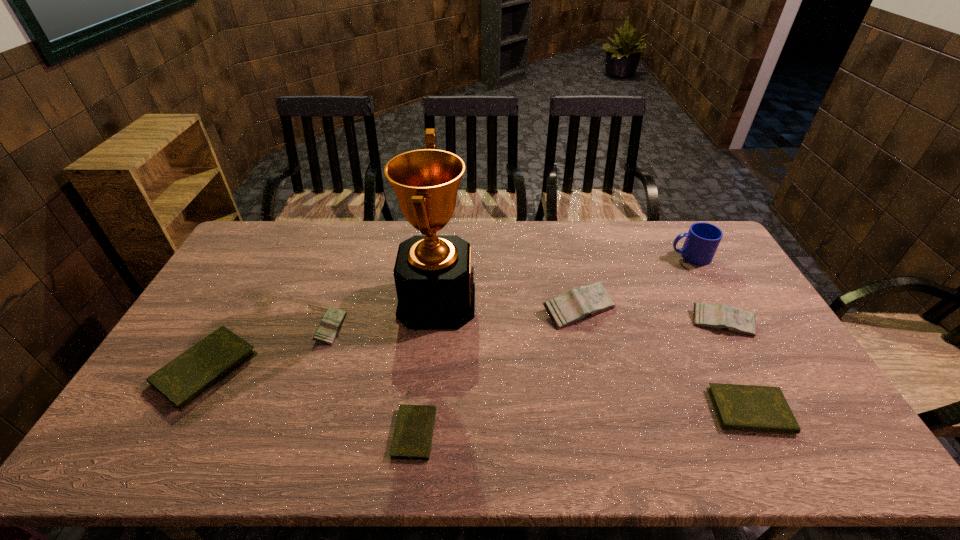
The image size is (960, 540). I want to click on object present at the near right corner, so click(x=738, y=407).

Identify the location of vacant region at the far edge of the desktop. (468, 236).

Locate an element on the screen. Image resolution: width=960 pixels, height=540 pixels. vacant space at the near edge is located at coordinates (368, 436).

Identify the location of vacant space at the right edge. (729, 265).

In the image, there is a desktop. Identify the location of vacant space at the far right corner. (684, 242).

In the image, there is a desktop. Identify the location of vacant space at the near right corner. (856, 454).

Identify the location of vacant space in between the fourth diary from right to left and the leftmost pink diary. (372, 381).

Locate an element on the screen. This screenshot has height=540, width=960. unoccupied area between the biggest green diary and the second pink diary from right to left is located at coordinates (392, 339).

Where is `free space between the mug and the third tallest diary`? Image resolution: width=960 pixels, height=540 pixels. free space between the mug and the third tallest diary is located at coordinates (511, 292).

Locate an element on the screen. free area in between the blue mug and the second diary from left to right is located at coordinates (511, 292).